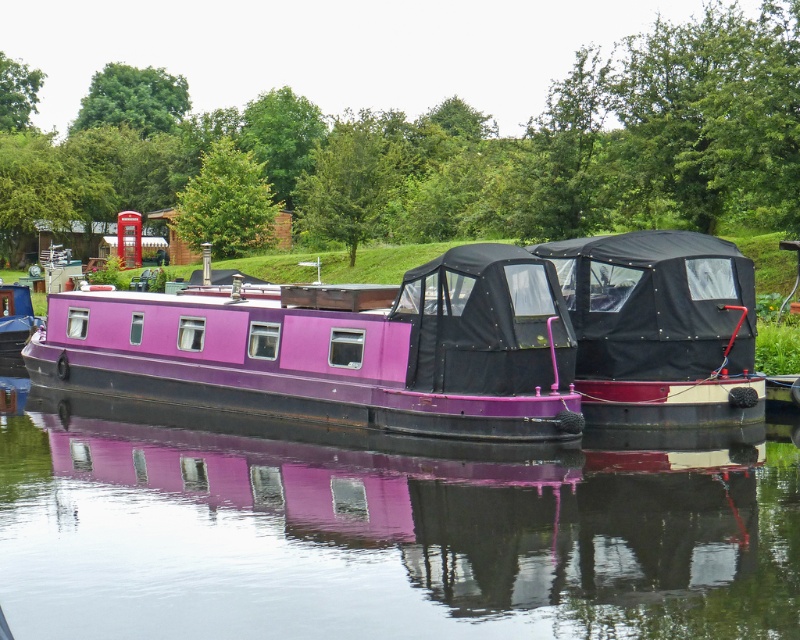
You are a tour guide leading a group on a narrow walkway between the purple glossy boat at center and the black matte boat at center. The walkway is 12 feet wide. Can your group safely pass through without touching either boat?

The distance between the purple glossy boat at center and the black matte boat at center is 12.74 feet, which is wider than the 12 feet walkway. Therefore, the group can safely pass through without touching either boat.

You are standing on the dock and want to board the purple glossy boat at center. Based on its position coordinates, where exactly should you walk to find it?

The purple glossy boat at center is located at coordinates point (384, 536), so you should walk towards that point to board it.

You are a delivery drone with a wingspan of 12 feet. You need to fly between the purple glossy boat at center and the purple glossy barge at center. Can you safely pass through the gap between them without touching either vessel?

The distance between the purple glossy boat at center and the purple glossy barge at center is 14.40 feet. Since your drone has a wingspan of 12 feet, there is enough space to safely pass through the gap as 14.40 feet is greater than 12 feet.